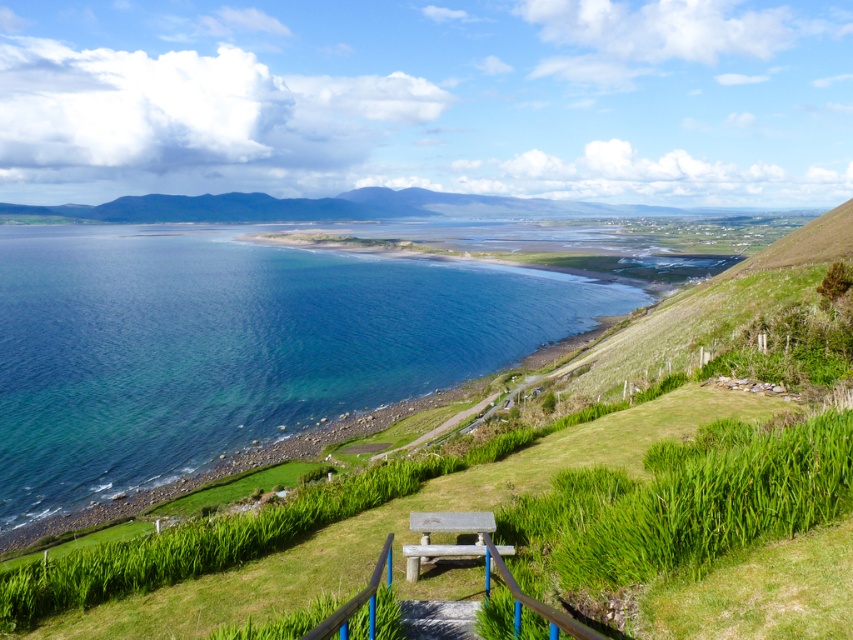
Question: Can you confirm if clear blue water at lower left is positioned below wooden park bench at center?

Choices:
 (A) no
 (B) yes

Answer: (A)

Question: Observing the image, what is the correct spatial positioning of clear blue water at lower left in reference to wooden park bench at center?

Choices:
 (A) below
 (B) above

Answer: (B)

Question: Is clear blue water at lower left smaller than wooden park bench at center?

Choices:
 (A) yes
 (B) no

Answer: (B)

Question: Among these points, which one is farthest from the camera?

Choices:
 (A) (460, 513)
 (B) (331, 368)

Answer: (B)

Question: Which object is farther from the camera taking this photo?

Choices:
 (A) clear blue water at lower left
 (B) wooden park bench at center

Answer: (A)